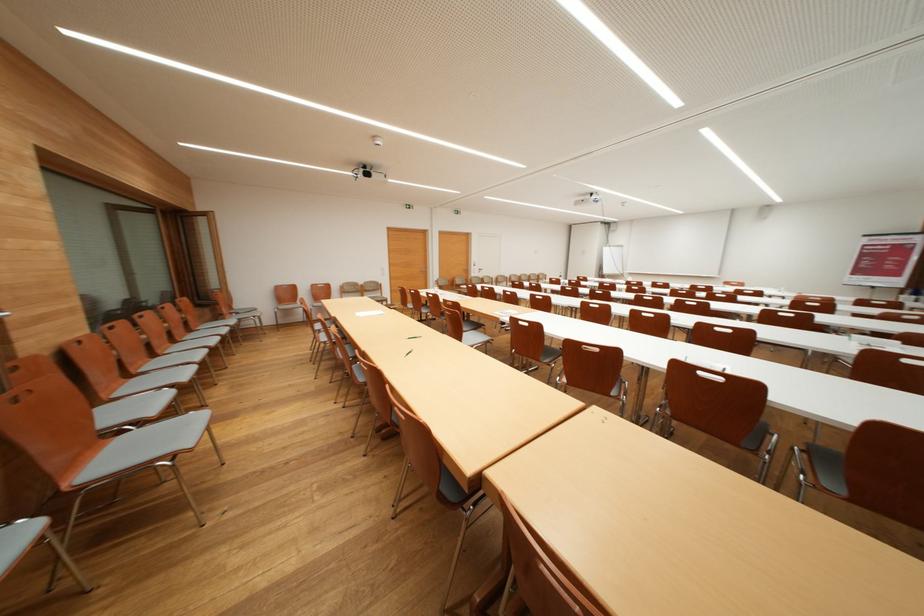
Find where to turn the window handle. Please return your answer as a coordinate pair (x, y).

(611, 260)